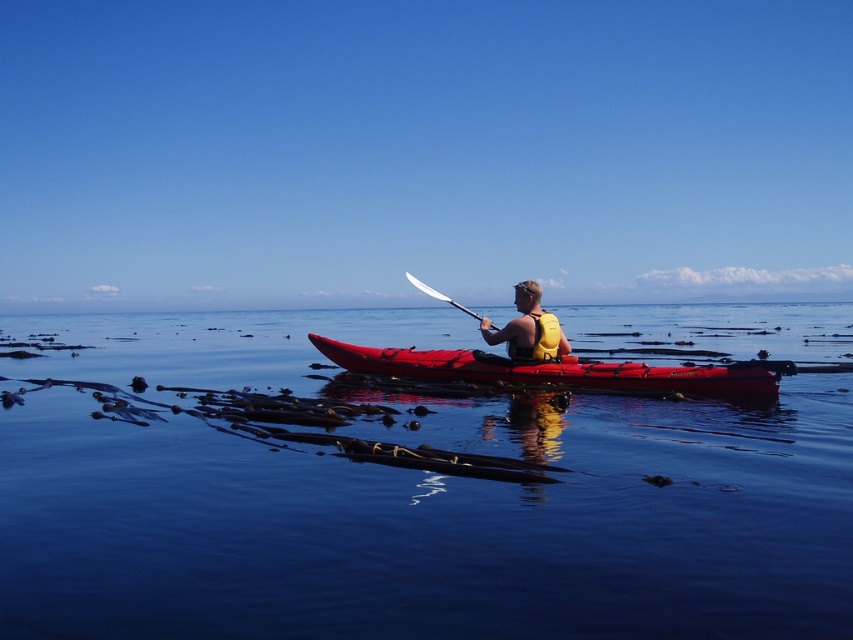
Question: Does transparent water at center lie in front of yellow life vest at center?

Choices:
 (A) no
 (B) yes

Answer: (B)

Question: Does yellow life vest at center appear under white plastic paddle at center?

Choices:
 (A) yes
 (B) no

Answer: (A)

Question: Which point is farther from the camera taking this photo?

Choices:
 (A) (672, 368)
 (B) (250, 528)
 (C) (457, 305)
 (D) (525, 282)

Answer: (C)

Question: Among these points, which one is farthest from the camera?

Choices:
 (A) (543, 333)
 (B) (463, 310)

Answer: (B)

Question: Is transparent water at center to the right of matte red kayak at center from the viewer's perspective?

Choices:
 (A) no
 (B) yes

Answer: (A)

Question: Which point is farther to the camera?

Choices:
 (A) matte red kayak at center
 (B) transparent water at center
 (C) white plastic paddle at center

Answer: (C)